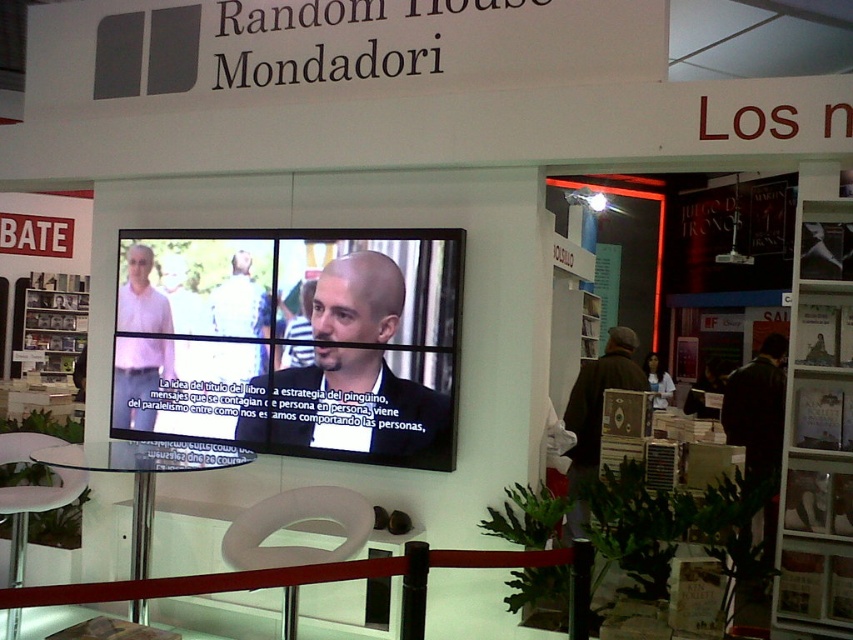
You are a photographer at the book fair and want to capture both the matte white shirt at upper left and the dark brown leather jacket at lower right in a single shot. Based on their heights, which object should you focus on to ensure both are in frame without cropping?

The matte white shirt at upper left is shorter than the dark brown leather jacket at lower right. To include both in the frame, focus on the center between them, ensuring the camera angle accommodates their height difference.

You are a photographer at the Random House Mondadori booth. You need to capture both the matte black suit at center and the dark brown leather jacket at lower right in a single frame. Which object should you focus on first to ensure both are in the frame without moving the camera?

The matte black suit at center is not as tall as the dark brown leather jacket at lower right, so you should focus on the taller dark brown leather jacket at lower right first to ensure both are in frame.

You are standing at the camera position and want to hand a book to the person wearing the matte white shirt at upper left. Considering the red velvet rope barrier, can you reach them without crossing the barrier?

The distance between the matte white shirt at upper left and the camera is 13.73 feet. Since the red velvet rope barrier is typically placed close to the booth entrance, it is likely within reach without crossing the barrier if you extend your arm. However, exact reachability depends on the barrier placement, but the distance suggests it might be possible.